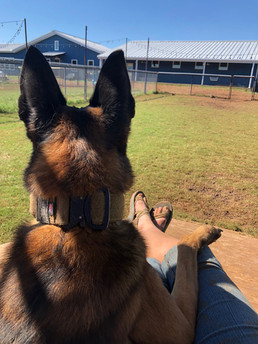
The width and height of the screenshot is (258, 344). I want to click on window, so click(223, 66), click(199, 66), click(174, 63), click(156, 63), click(90, 63), click(74, 62), click(57, 47).